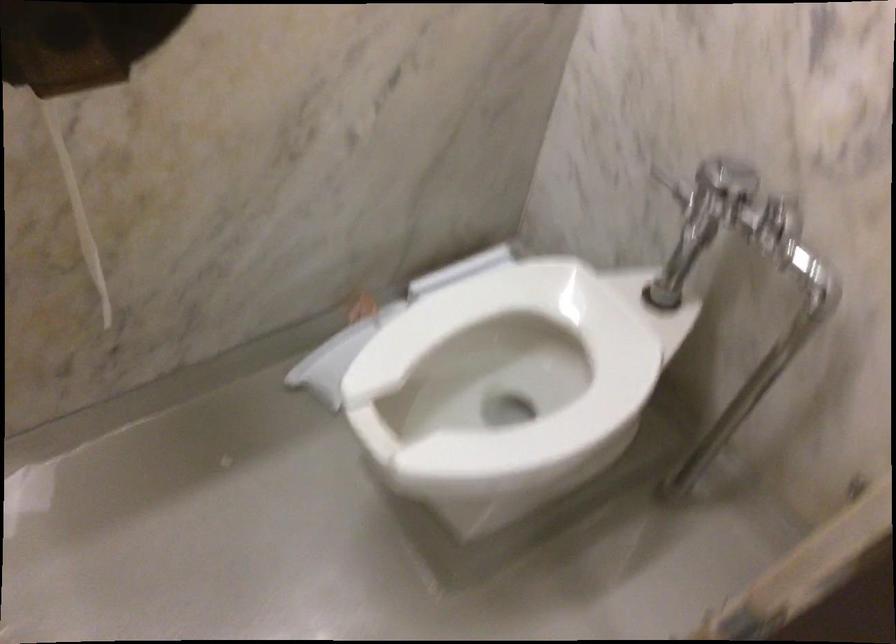
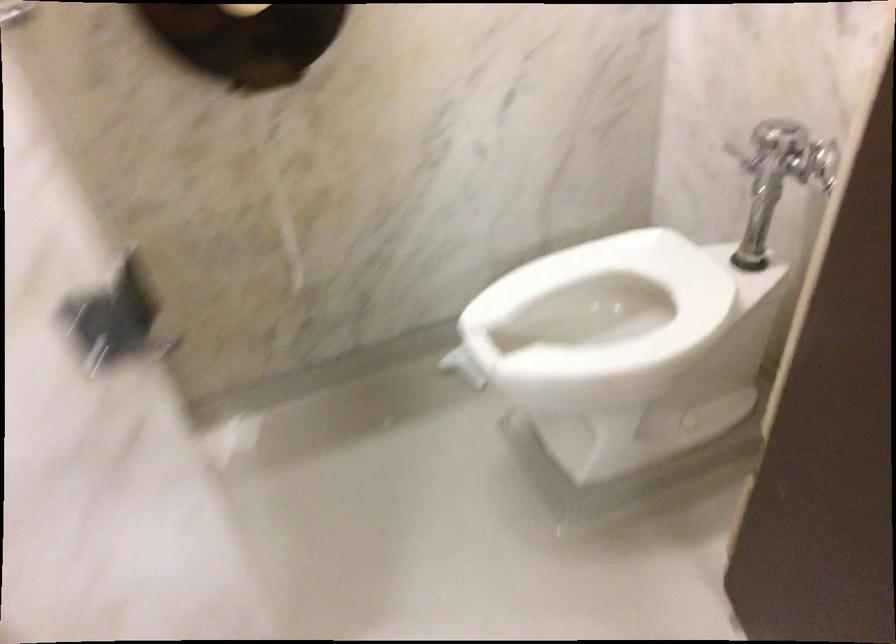
Which direction would the cameraman need to move to produce the second image?

The cameraman moved toward right, backward.